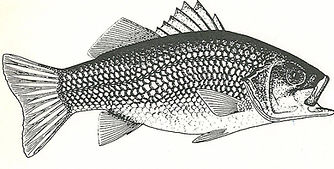
This screenshot has width=334, height=169. Find the location of `scales`. scales is located at coordinates (169, 87).